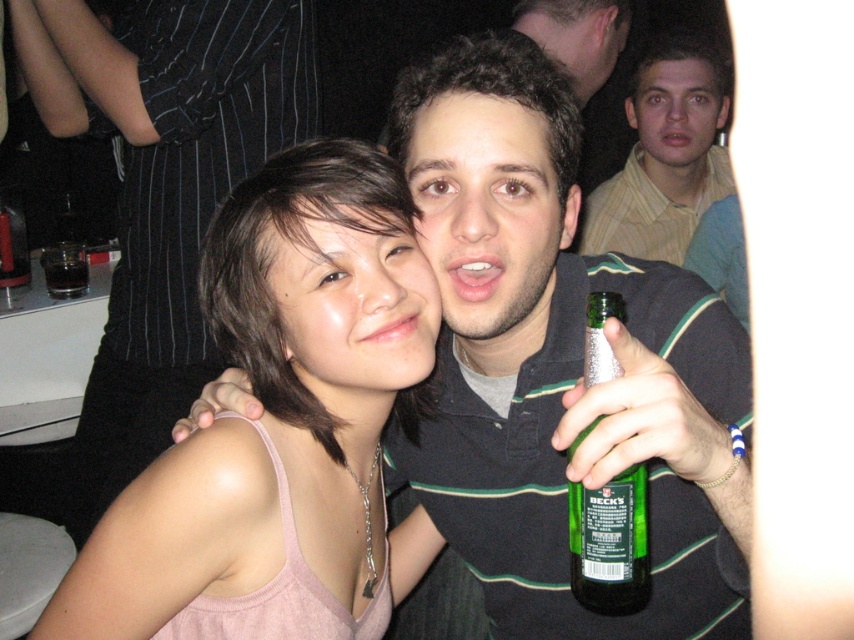
Is pink fabric tank top at center above dark liquid glass at upper left?

Incorrect, pink fabric tank top at center is not positioned above dark liquid glass at upper left.

Between pink fabric tank top at center and dark liquid glass at upper left, which one appears on the left side from the viewer's perspective?

dark liquid glass at upper left is more to the left.

Locate an element on the screen. The height and width of the screenshot is (640, 854). pink fabric tank top at center is located at coordinates (278, 403).

Can you confirm if green glass bottle at center is positioned to the left of dark liquid glass at upper left?

Incorrect, green glass bottle at center is not on the left side of dark liquid glass at upper left.

Is green glass bottle at center wider than dark liquid glass at upper left?

No, green glass bottle at center is not wider than dark liquid glass at upper left.

Describe the element at coordinates (610, 544) in the screenshot. I see `green glass bottle at center` at that location.

This screenshot has height=640, width=854. I want to click on green glass bottle at center, so click(610, 544).

What are the coordinates of `pink fabric tank top at center` in the screenshot? It's located at (278, 403).

In order to click on pink fabric tank top at center in this screenshot , I will do `click(278, 403)`.